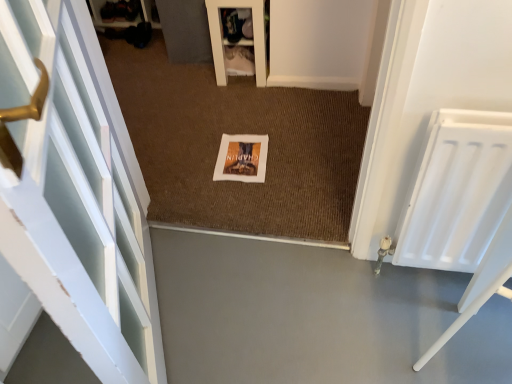
Question: Could you tell me if brown textured mat at center is facing white fabric shoe rack at upper center?

Choices:
 (A) no
 (B) yes

Answer: (A)

Question: Can we say brown textured mat at center lies outside white fabric shoe rack at upper center?

Choices:
 (A) no
 (B) yes

Answer: (B)

Question: Is brown textured mat at center in front of white fabric shoe rack at upper center?

Choices:
 (A) no
 (B) yes

Answer: (B)

Question: Is brown textured mat at center directly adjacent to white fabric shoe rack at upper center?

Choices:
 (A) no
 (B) yes

Answer: (A)

Question: Is brown textured mat at center to the left of white fabric shoe rack at upper center from the viewer's perspective?

Choices:
 (A) yes
 (B) no

Answer: (A)

Question: Does brown textured mat at center have a smaller size compared to white fabric shoe rack at upper center?

Choices:
 (A) yes
 (B) no

Answer: (B)

Question: Is white matte picture frame at center smaller than gray smooth concrete at center?

Choices:
 (A) yes
 (B) no

Answer: (A)

Question: Is white matte picture frame at center wider than gray smooth concrete at center?

Choices:
 (A) yes
 (B) no

Answer: (B)

Question: From a real-world perspective, is white matte picture frame at center under gray smooth concrete at center?

Choices:
 (A) no
 (B) yes

Answer: (A)

Question: Is white matte picture frame at center turned away from gray smooth concrete at center?

Choices:
 (A) no
 (B) yes

Answer: (A)

Question: Is white matte picture frame at center to the left of gray smooth concrete at center from the viewer's perspective?

Choices:
 (A) yes
 (B) no

Answer: (B)

Question: Does white matte picture frame at center have a lesser height compared to gray smooth concrete at center?

Choices:
 (A) yes
 (B) no

Answer: (A)

Question: From a real-world perspective, does white fabric shoe rack at upper center stand above gray smooth concrete at center?

Choices:
 (A) yes
 (B) no

Answer: (A)